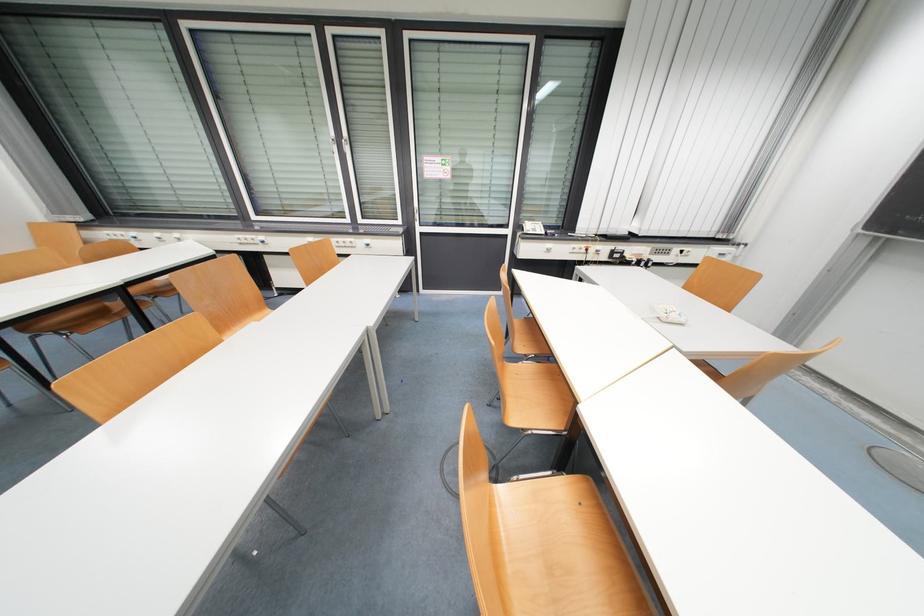
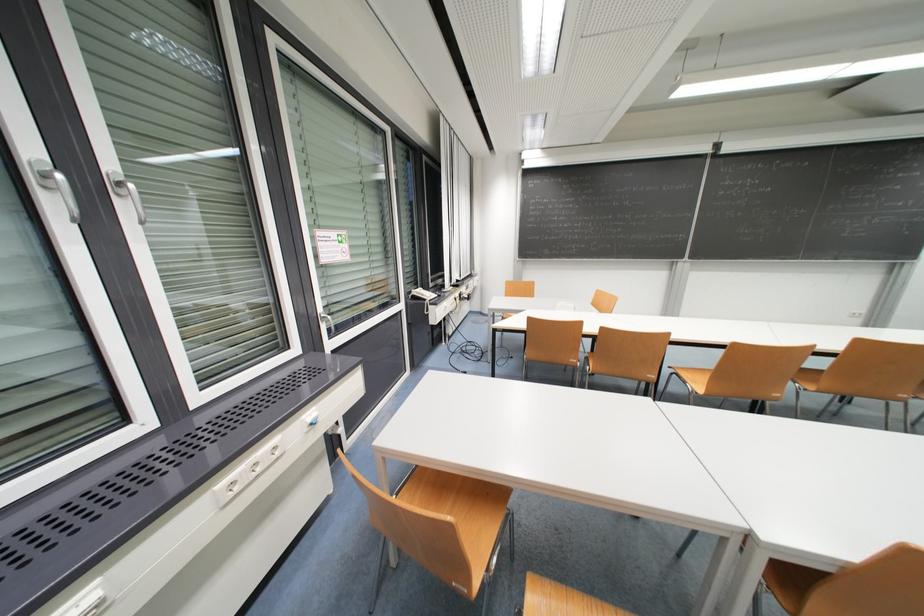
Question: I am providing you with two images of the same scene from different viewpoints. Which of the following objects are not visible in image2?

Choices:
 (A) telephone handset
 (B) small drawer knob
 (C) yellow spray bottle nozzle
 (D) chair sitting surface

Answer: (B)